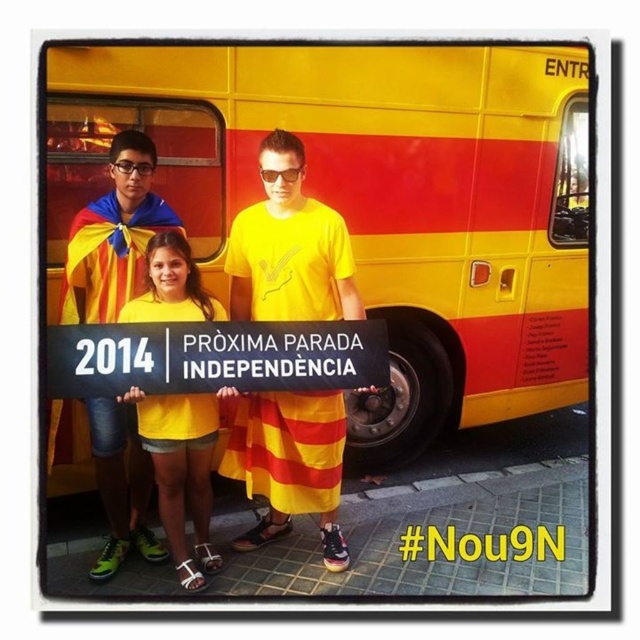
Between yellow matte bus at center and yellow matte t-shirt at center, which one has less height?

With less height is yellow matte t-shirt at center.

Measure the distance between point (492,230) and camera.

A distance of 3.87 meters exists between point (492,230) and camera.

The width and height of the screenshot is (640, 640). In order to click on yellow matte bus at center in this screenshot , I will do `click(362, 202)`.

Does yellow matte bus at center have a lesser width compared to yellow matte shirt at center?

Incorrect, yellow matte bus at center's width is not less than yellow matte shirt at center's.

In order to click on yellow matte bus at center in this screenshot , I will do `click(362, 202)`.

The image size is (640, 640). What are the coordinates of `yellow matte bus at center` in the screenshot? It's located at (362, 202).

Is yellow matte t-shirt at center closer to camera compared to yellow matte/yellow t-shirt at center?

No, it is behind yellow matte/yellow t-shirt at center.

Locate an element on the screen. yellow matte t-shirt at center is located at coordinates (289, 248).